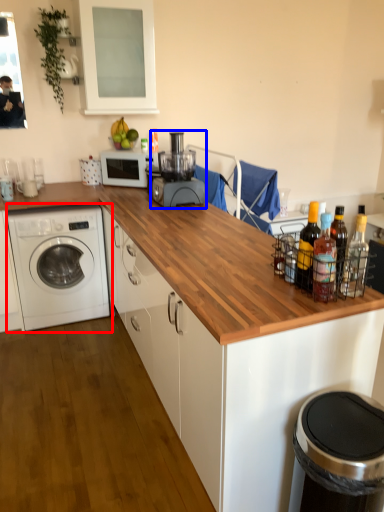
Question: Which object appears closest to the camera in this image, washing machine (highlighted by a red box) or blender (highlighted by a blue box)?

Choices:
 (A) washing machine
 (B) blender

Answer: (B)